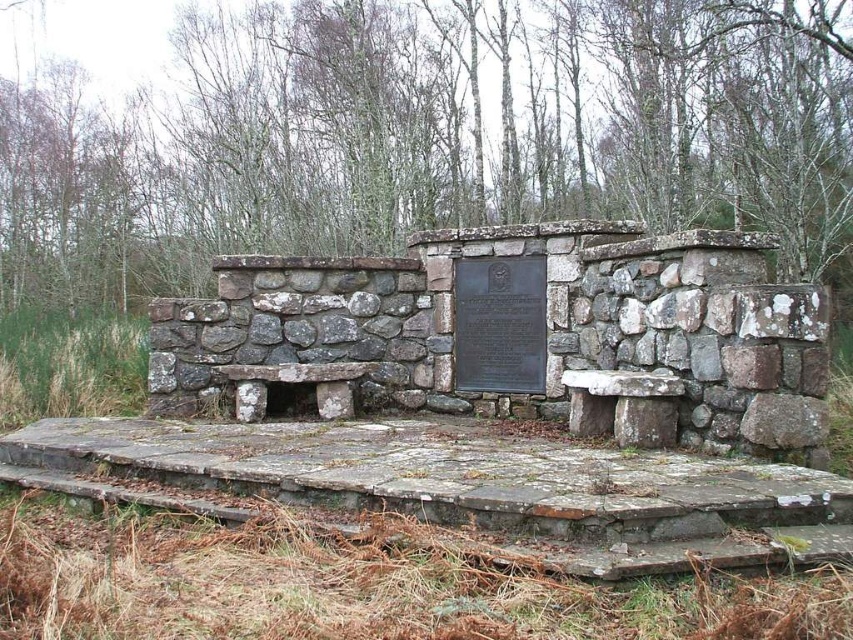
You are standing at the base of the memorial wall and want to sit down. There is a rustic stone bench at center. Can you walk directly to the point marked at coordinates (520,336) to sit there?

The point marked at coordinates (520,336) is on the rustic stone bench at center, so yes, you can walk directly to that point to sit there.

You are a visitor at the memorial and want to place a bouquet of flowers between the rustic stone bench at center and the bronze plaque at center. Can you fit the bouquet there if it requires 45 centimeters of space?

The distance between the rustic stone bench at center and the bronze plaque at center is 43.98 centimeters, which is slightly less than the required 45 centimeters. Therefore, the bouquet may not fit comfortably between them.

You are visiting the memorial and want to read the inscriptions on the bronze plaque at center. Where should you position yourself relative to the rustic stone bench at center to get a clear view?

To read the inscriptions on the bronze plaque at center, you should position yourself behind the rustic stone bench at center since it is in front of the bronze plaque at center and would block the view otherwise.